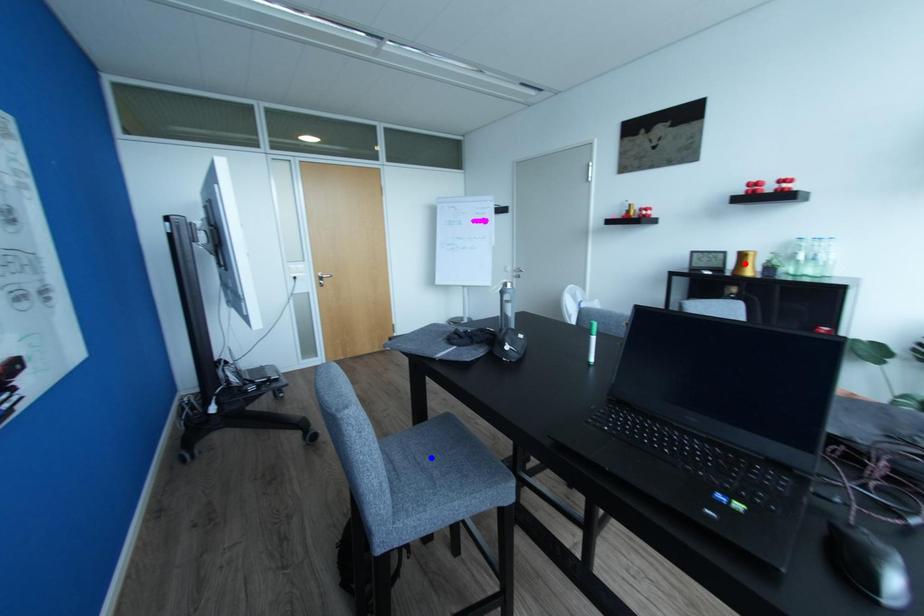
Question: In the image, two points are highlighted. Which point is nearer to the camera? Reply with the corresponding letter.

Choices:
 (A) blue point
 (B) red point

Answer: (A)